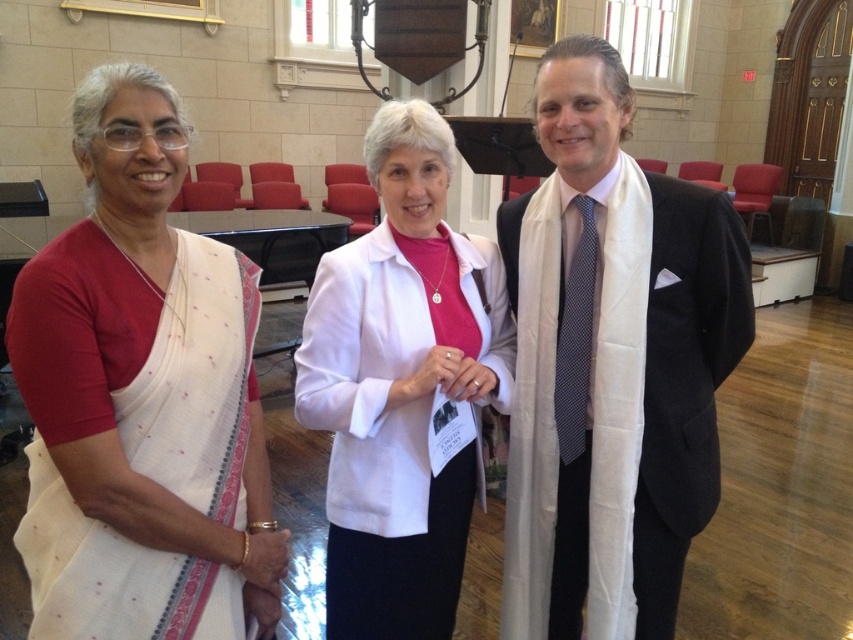
Question: Does white textured saree at left have a smaller size compared to white matte jacket at center?

Choices:
 (A) yes
 (B) no

Answer: (A)

Question: Among these points, which one is nearest to the camera?

Choices:
 (A) (210, 444)
 (B) (558, 332)
 (C) (409, 170)
 (D) (671, 413)

Answer: (A)

Question: Can you confirm if white silk scarf at center is wider than dark blue dotted tie at center?

Choices:
 (A) no
 (B) yes

Answer: (B)

Question: Which point is farther to the camera?

Choices:
 (A) white matte jacket at center
 (B) white textured saree at left
 (C) white silk scarf at center
 (D) dark blue dotted tie at center

Answer: (D)

Question: Which object appears farthest from the camera in this image?

Choices:
 (A) white matte jacket at center
 (B) white silk scarf at center
 (C) dark blue dotted tie at center

Answer: (C)

Question: Does white textured saree at left have a lesser width compared to dark blue dotted tie at center?

Choices:
 (A) yes
 (B) no

Answer: (B)